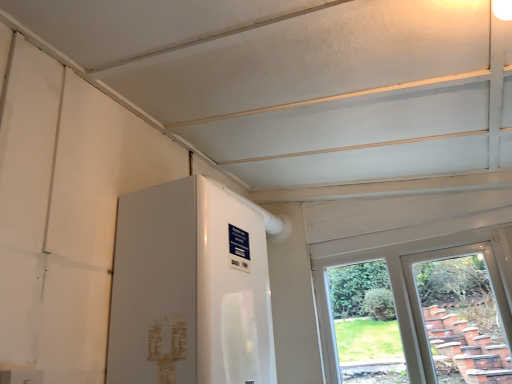
Question: Is white glossy water heater at center in front of or behind clear glass window at right in the image?

Choices:
 (A) front
 (B) behind

Answer: (A)

Question: From the image's perspective, is white glossy water heater at center located above or below clear glass window at right?

Choices:
 (A) below
 (B) above

Answer: (B)

Question: Is point (112, 339) positioned closer to the camera than point (490, 231)?

Choices:
 (A) closer
 (B) farther

Answer: (A)

Question: From a real-world perspective, is clear glass window at right physically located above or below white glossy water heater at center?

Choices:
 (A) below
 (B) above

Answer: (A)

Question: Looking at their shapes, would you say clear glass window at right is wider or thinner than white glossy water heater at center?

Choices:
 (A) wide
 (B) thin

Answer: (B)

Question: In the image, is clear glass window at right positioned in front of or behind white glossy water heater at center?

Choices:
 (A) behind
 (B) front

Answer: (A)

Question: In the image, is clear glass window at right on the left side or the right side of white glossy water heater at center?

Choices:
 (A) left
 (B) right

Answer: (B)